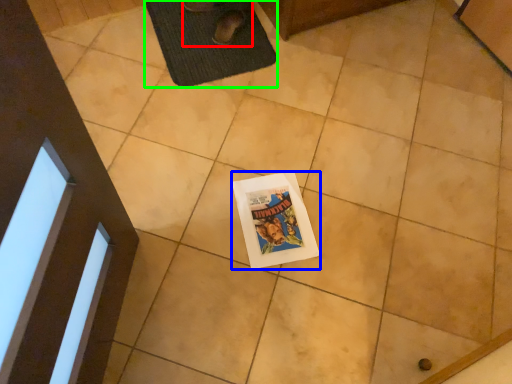
Question: Based on their relative distances, which object is nearer to person (highlighted by a red box)? Choose from comic book (highlighted by a blue box) and bath mat (highlighted by a green box).

Choices:
 (A) comic book
 (B) bath mat

Answer: (B)